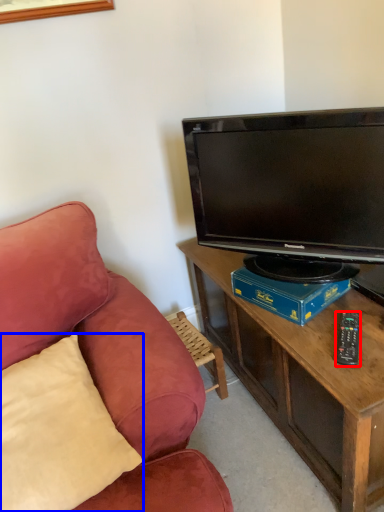
Question: Which object is further to the camera taking this photo, remote control (highlighted by a red box) or pillow (highlighted by a blue box)?

Choices:
 (A) remote control
 (B) pillow

Answer: (A)